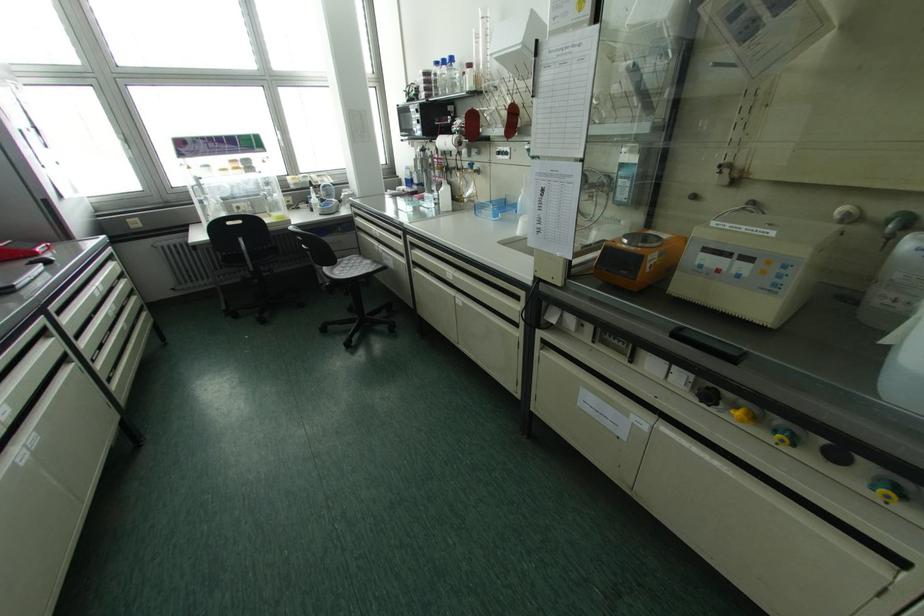
The height and width of the screenshot is (616, 924). Find the location of `yellow control knob`. yellow control knob is located at coordinates (744, 415).